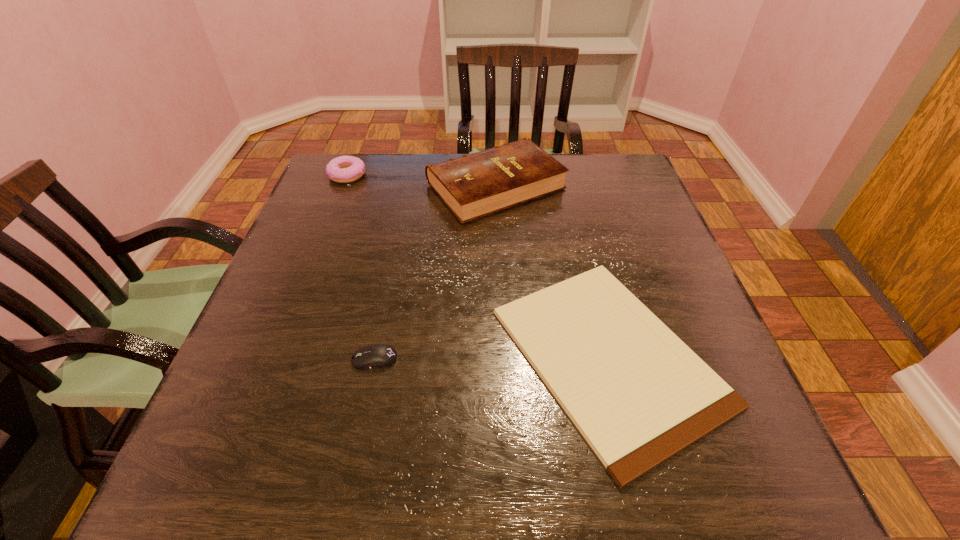
You are a GUI agent. You are given a task and a screenshot of the screen. Output one action in this format:
    pyautogui.click(x=<x>, y=<y>)
    Task: Click on the hardback book
    This screenshot has width=960, height=540.
    Given the screenshot: What is the action you would take?
    pyautogui.click(x=472, y=186)

You are a GUI agent. You are given a task and a screenshot of the screen. Output one action in this format:
    pyautogui.click(x=<x>, y=<y>)
    Task: Click on the leftmost object
    The height and width of the screenshot is (540, 960).
    Given the screenshot: What is the action you would take?
    pyautogui.click(x=345, y=169)

I want to click on doughnut, so click(345, 169).

Find the location of a particular element. The width and height of the screenshot is (960, 540). the second object from left to right is located at coordinates (379, 355).

The width and height of the screenshot is (960, 540). What are the coordinates of `the third tallest object` in the screenshot? It's located at (379, 355).

In order to click on the shortest object in this screenshot , I will do `click(637, 393)`.

Locate an element on the screen. The image size is (960, 540). free space located 0.110m on the right of the hardback book is located at coordinates (606, 186).

At what (x,y) coordinates should I click in order to perform the action: click on vacant space located on the front of the second tallest object. Please return your answer as a coordinate pair (x, y). The image size is (960, 540). Looking at the image, I should click on (324, 237).

At what (x,y) coordinates should I click in order to perform the action: click on vacant space located on the right of the second object from left to right. Please return your answer as a coordinate pair (x, y). Looking at the image, I should click on (612, 359).

The width and height of the screenshot is (960, 540). Identify the location of vacant space located on the left of the clipboard. (319, 356).